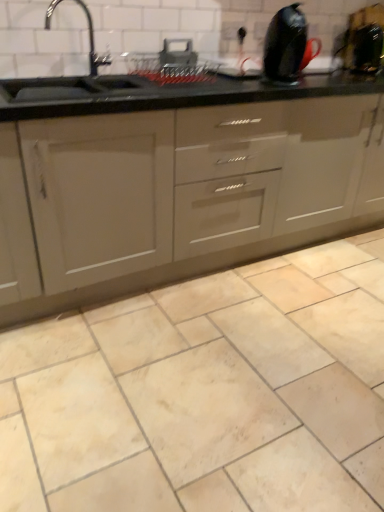
I want to click on vacant point to the right of metallic silver toaster at upper center, acting as the 2th appliance starting from the left, so click(218, 75).